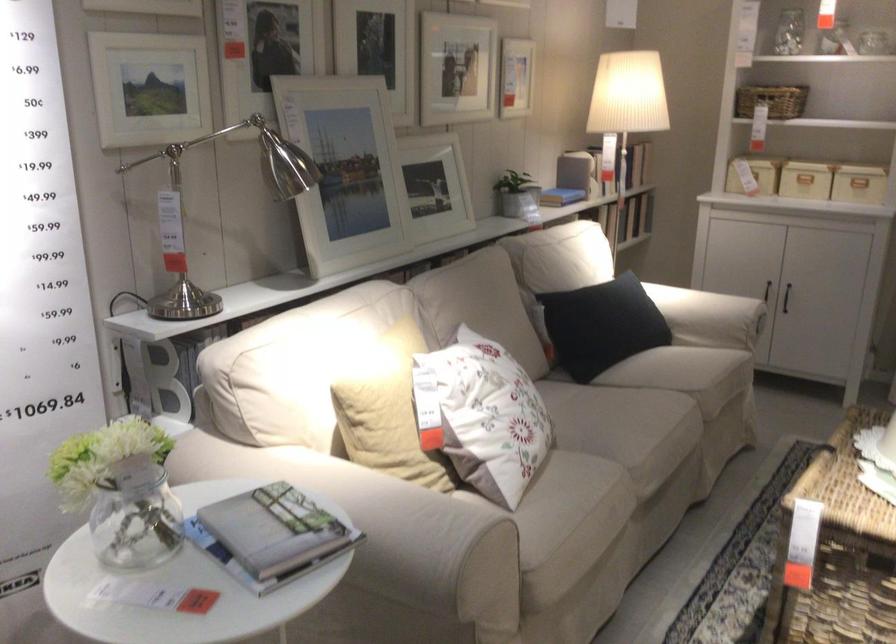
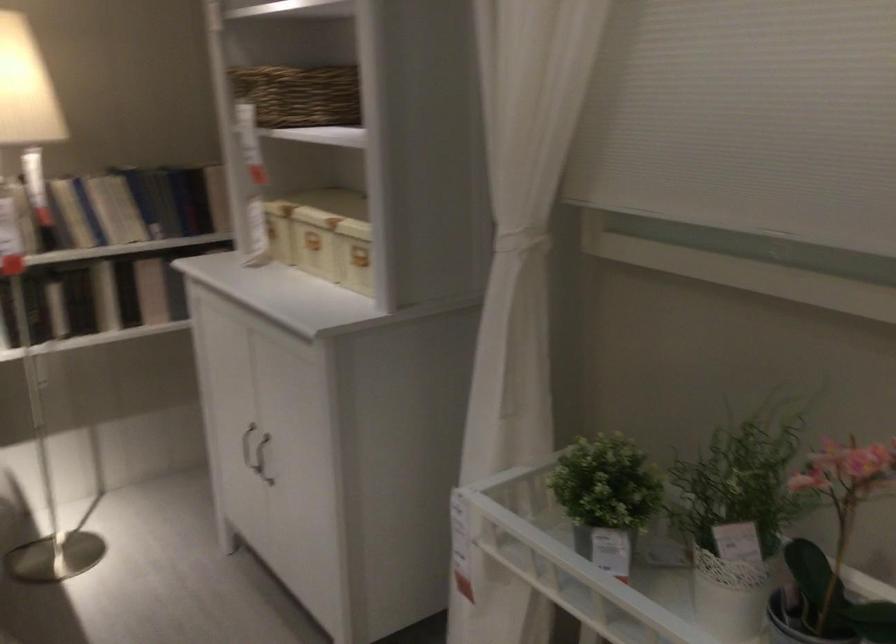
The point at (774, 279) is marked in the first image. Where is the corresponding point in the second image?

(247, 446)